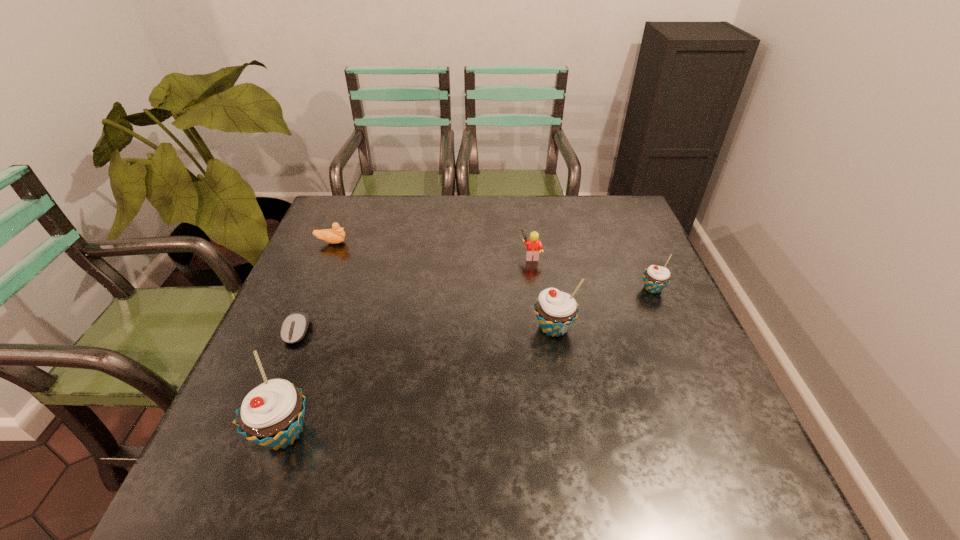
Please point a location where one more cupcake can be added evenly. Please provide its 2D coordinates. Your answer should be formatted as a tuple, i.e. [(x, y)], where the tuple contains the x and y coordinates of a point satisfying the conditions above.

[(433, 374)]